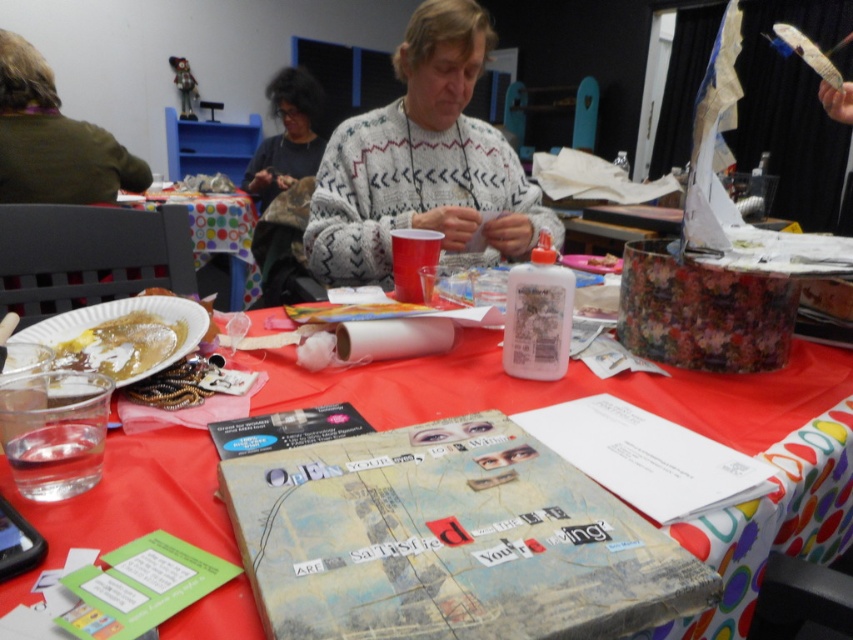
You are organizing a craft fair and need to arrange items on the table. The brown fuzzy sweater at upper left and the yellowish matte pancake at lower left are already placed. Which item is positioned more to the left side of the table?

The brown fuzzy sweater at upper left is positioned more to the left side of the table than the yellowish matte pancake at lower left.

What are the coordinates of the white knitted sweater at center?

The white knitted sweater at center is located at coordinates point [422,161].

Based on the photo, you are an artist standing at the edge of the table where the brown fuzzy sweater at upper left and the red polka dot tablecloth at center are located. If you want to reach both items without moving your position, which one would you have to stretch further to reach?

The brown fuzzy sweater at upper left is closer to the viewer than the red polka dot tablecloth at center, so you would have to stretch further to reach the red polka dot tablecloth at center.